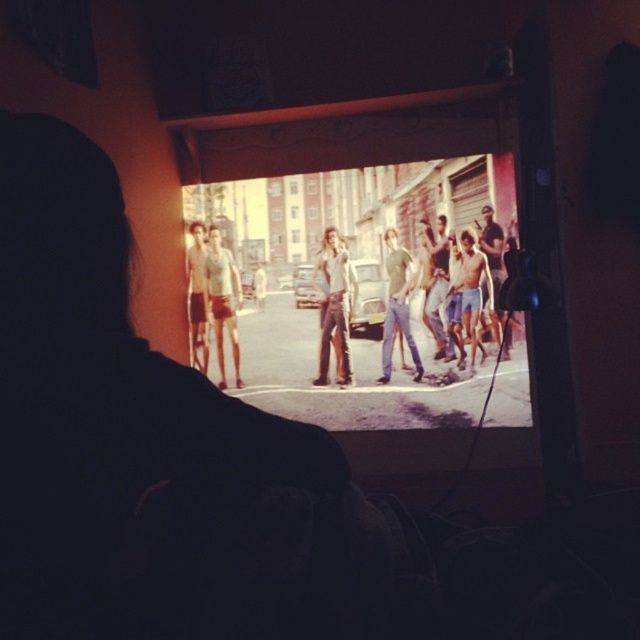
Question: Which point is closer to the camera taking this photo?

Choices:
 (A) (205, 310)
 (B) (328, 316)

Answer: (B)

Question: Does denim pants at center come in front of light brown leather jacket at center?

Choices:
 (A) yes
 (B) no

Answer: (B)

Question: Considering the relative positions of denim pants at center and light green cotton shirt at center in the image provided, where is denim pants at center located with respect to light green cotton shirt at center?

Choices:
 (A) below
 (B) above

Answer: (A)

Question: Which object is closer to the camera taking this photo?

Choices:
 (A) light brown leather jacket at center
 (B) light green cotton shirt at center
 (C) matte shorts at center

Answer: (A)

Question: Estimate the real-world distances between objects in this image. Which object is closer to the vivid yellow street at center?

Choices:
 (A) smooth beige shorts at center
 (B) matte shorts at center
 (C) denim pants at center
 (D) shiny metallic shirt at center

Answer: (C)

Question: Can you confirm if light green cotton shirt at center is wider than light brown leather jacket at center?

Choices:
 (A) no
 (B) yes

Answer: (B)